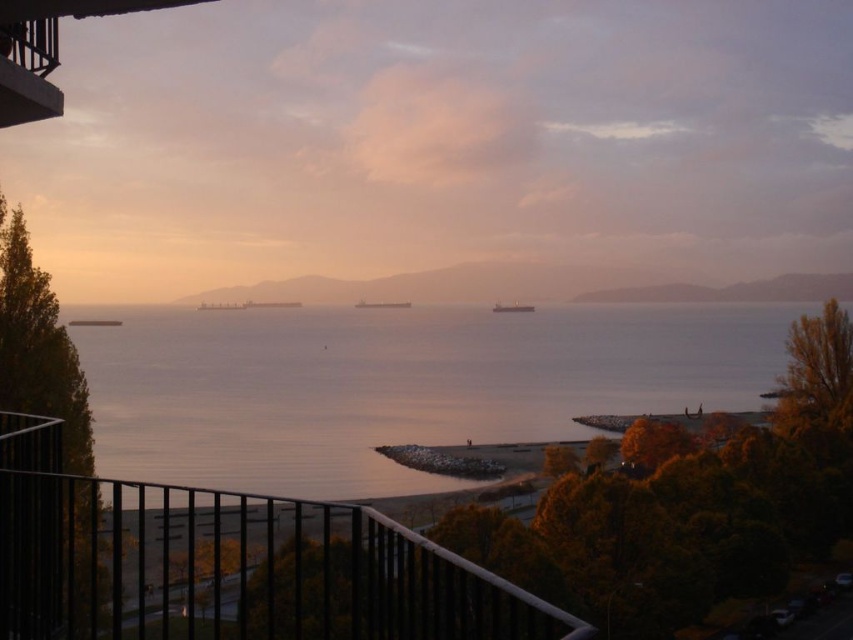
You are standing on the balcony and want to take a photo of the matte gray ship at center without the black metal railing at lower left blocking the view. Is the railing in the way?

The black metal railing at lower left is in front of the matte gray ship at center, so it will block the view of the matte gray ship at center. Move to a position where the railing is not between you and the ship.

You are standing on the balcony and looking out at the coastal scene. Which object, the black metal railing at lower left or the black metal balcony at upper left, is closer to you?

The black metal railing at lower left is closer to you because it is in front of the black metal balcony at upper left.